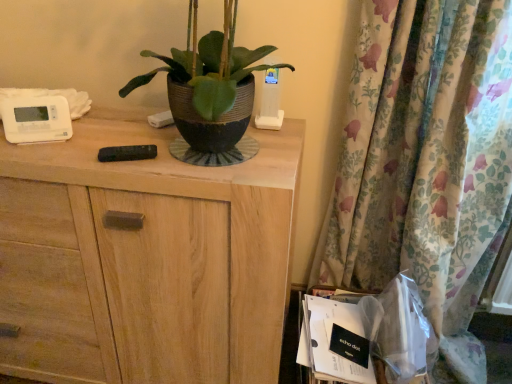
Question: Does transparent plastic bag at lower right come behind floral fabric curtain at right?

Choices:
 (A) yes
 (B) no

Answer: (A)

Question: From the image's perspective, is transparent plastic bag at lower right under floral fabric curtain at right?

Choices:
 (A) yes
 (B) no

Answer: (A)

Question: Is transparent plastic bag at lower right thinner than floral fabric curtain at right?

Choices:
 (A) no
 (B) yes

Answer: (B)

Question: Is transparent plastic bag at lower right taller than floral fabric curtain at right?

Choices:
 (A) yes
 (B) no

Answer: (B)

Question: Is transparent plastic bag at lower right closer to the viewer compared to floral fabric curtain at right?

Choices:
 (A) yes
 (B) no

Answer: (B)

Question: Is transparent plastic bag at lower right oriented away from floral fabric curtain at right?

Choices:
 (A) yes
 (B) no

Answer: (A)

Question: Is wooden cabinet at center at the right side of transparent plastic bag at lower right?

Choices:
 (A) no
 (B) yes

Answer: (A)

Question: Is wooden cabinet at center positioned far away from transparent plastic bag at lower right?

Choices:
 (A) no
 (B) yes

Answer: (A)

Question: From a real-world perspective, is wooden cabinet at center physically below transparent plastic bag at lower right?

Choices:
 (A) yes
 (B) no

Answer: (A)

Question: Is wooden cabinet at center thinner than transparent plastic bag at lower right?

Choices:
 (A) no
 (B) yes

Answer: (A)

Question: Can you confirm if wooden cabinet at center is bigger than transparent plastic bag at lower right?

Choices:
 (A) no
 (B) yes

Answer: (B)

Question: Is the depth of wooden cabinet at center less than that of transparent plastic bag at lower right?

Choices:
 (A) yes
 (B) no

Answer: (A)

Question: From the image's perspective, is white paper at lower right located above floral fabric curtain at right?

Choices:
 (A) no
 (B) yes

Answer: (A)